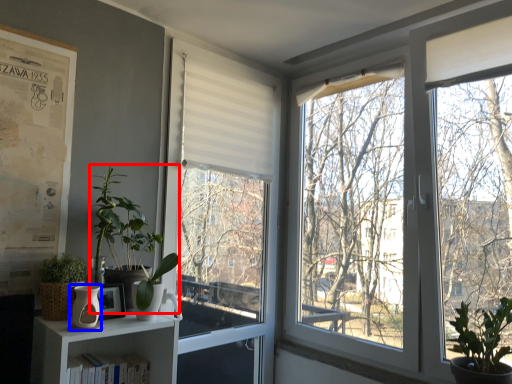
Question: Which of the following is the closest to the observer, vegetation (highlighted by a red box) or vase (highlighted by a blue box)?

Choices:
 (A) vegetation
 (B) vase

Answer: (B)